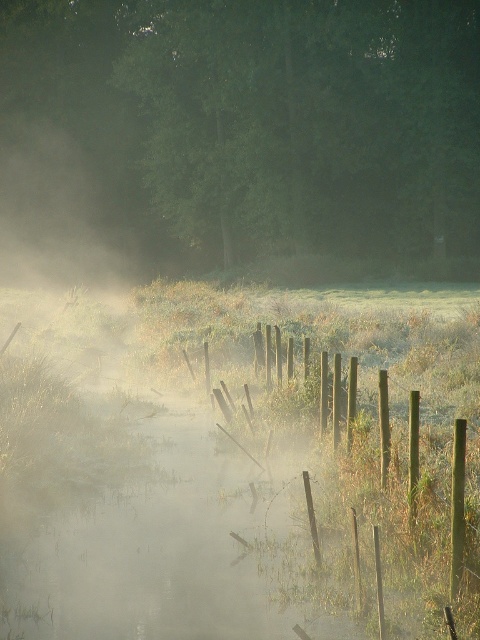
Question: Which point is farther to the camera?

Choices:
 (A) green wooden fence at center
 (B) green matte tree at upper center

Answer: (B)

Question: Which object appears closest to the camera in this image?

Choices:
 (A) green wooden fence at center
 (B) green matte tree at upper center

Answer: (A)

Question: Can you confirm if green matte tree at upper center is wider than green wooden fence at center?

Choices:
 (A) no
 (B) yes

Answer: (B)

Question: Is green matte tree at upper center smaller than green wooden fence at center?

Choices:
 (A) no
 (B) yes

Answer: (A)

Question: Does green matte tree at upper center have a larger size compared to green wooden fence at center?

Choices:
 (A) no
 (B) yes

Answer: (B)